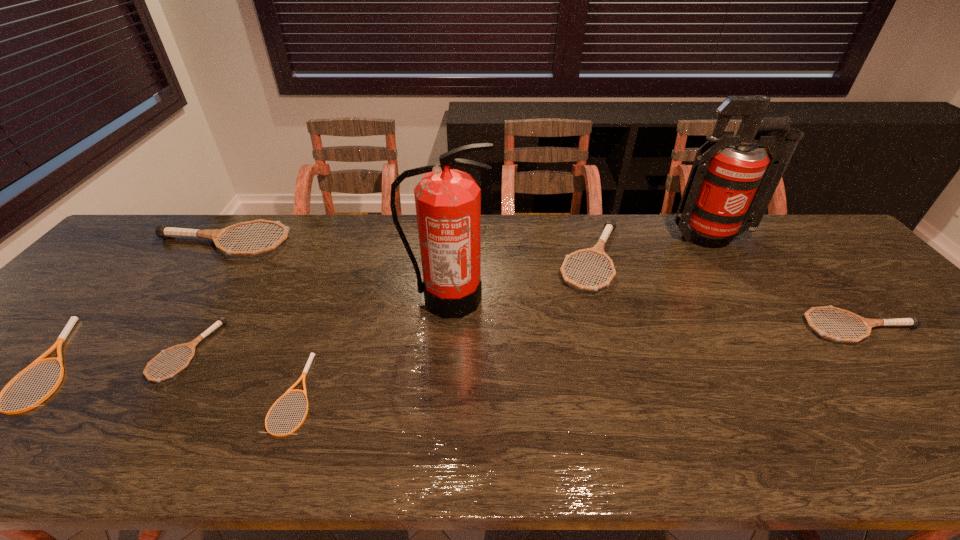
Identify the location of vacant space at the far left corner. (127, 240).

Identify the location of vacant space that is in between the rightmost tennis racket and the third tennis racket from right to left. The width and height of the screenshot is (960, 540). (578, 360).

The image size is (960, 540). I want to click on free space between the nearer fire extinguisher and the second gray tennis racket from right to left, so click(519, 279).

Where is `free space between the black fire extinguisher and the smaller beige tennis racket`? This screenshot has width=960, height=540. free space between the black fire extinguisher and the smaller beige tennis racket is located at coordinates (372, 346).

What are the coordinates of `free area in between the smallest gray tennis racket and the fifth tennis racket from left to right` in the screenshot? It's located at (389, 305).

At what (x,y) coordinates should I click in order to perform the action: click on object that is the closest one to the right fire extinguisher. Please return your answer as a coordinate pair (x, y). Looking at the image, I should click on (598, 249).

Locate an element on the screen. The height and width of the screenshot is (540, 960). object that stands as the closest to the third tallest tennis racket is located at coordinates (729, 188).

Locate an element on the screen. This screenshot has width=960, height=540. tennis racket that is the third closest to the fifth object from right to left is located at coordinates (61, 339).

Where is `tennis racket that stands as the closest to the tallest tennis racket`? tennis racket that stands as the closest to the tallest tennis racket is located at coordinates (61, 339).

The height and width of the screenshot is (540, 960). Identify the location of the third closest gray tennis racket to the third tennis racket from right to left. tap(598, 249).